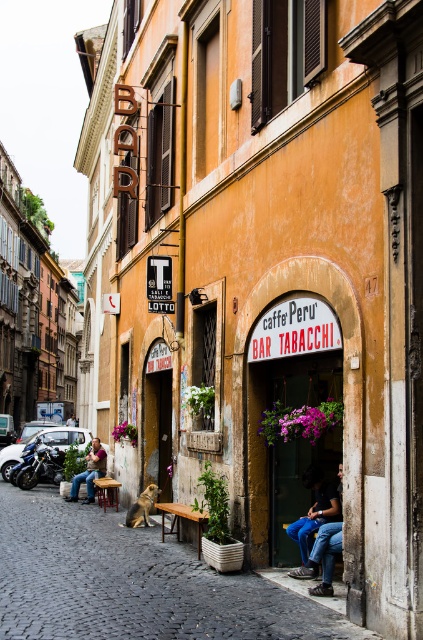
You are a street vendor who wants to place both the blue fabric bag at lower right and the denim jeans at lower center on a small table that can only hold one item at a time. Which item should you place first to ensure both can fit?

The blue fabric bag at lower right is larger in size than the denim jeans at lower center. To ensure both can fit on the small table, you should place the denim jeans at lower center first, then the blue fabric bag at lower right.

You are a tourist visiting the historic European city and want to place your blue fabric bag at lower right on the brown wooden park bench at center. Can you put it there?

The blue fabric bag at lower right is currently in front of the brown wooden park bench at center, so you can move it onto the bench.